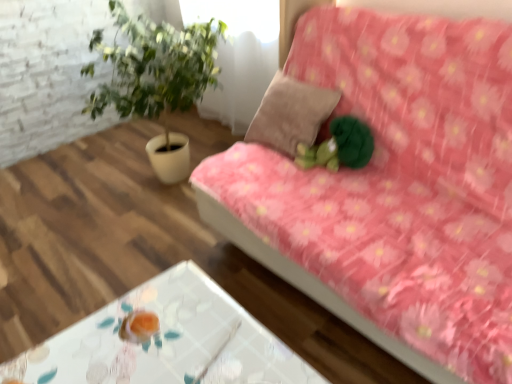
Question: Is green plush toy at center placed right next to suede-like beige pillow at center?

Choices:
 (A) yes
 (B) no

Answer: (B)

Question: Are green plush toy at center and suede-like beige pillow at center located far from each other?

Choices:
 (A) yes
 (B) no

Answer: (B)

Question: Does green plush toy at center lie in front of suede-like beige pillow at center?

Choices:
 (A) yes
 (B) no

Answer: (A)

Question: From the image's perspective, is green plush toy at center below suede-like beige pillow at center?

Choices:
 (A) no
 (B) yes

Answer: (B)

Question: Can you confirm if green plush toy at center is taller than suede-like beige pillow at center?

Choices:
 (A) no
 (B) yes

Answer: (A)

Question: Is pink floral fabric couch at upper right to the left or to the right of transparent glass table at lower center in the image?

Choices:
 (A) left
 (B) right

Answer: (B)

Question: Considering the positions of pink floral fabric couch at upper right and transparent glass table at lower center in the image, is pink floral fabric couch at upper right taller or shorter than transparent glass table at lower center?

Choices:
 (A) tall
 (B) short

Answer: (A)

Question: Looking at their shapes, would you say pink floral fabric couch at upper right is wider or thinner than transparent glass table at lower center?

Choices:
 (A) wide
 (B) thin

Answer: (A)

Question: Is pink floral fabric couch at upper right in front of or behind transparent glass table at lower center in the image?

Choices:
 (A) behind
 (B) front

Answer: (B)

Question: Would you say suede-like beige pillow at center is inside or outside green plush toy at center?

Choices:
 (A) outside
 (B) inside

Answer: (A)

Question: In terms of width, does suede-like beige pillow at center look wider or thinner when compared to green plush toy at center?

Choices:
 (A) thin
 (B) wide

Answer: (B)

Question: Considering their positions, is suede-like beige pillow at center located in front of or behind green plush toy at center?

Choices:
 (A) behind
 (B) front

Answer: (A)

Question: In the image, is suede-like beige pillow at center on the left side or the right side of green plush toy at center?

Choices:
 (A) left
 (B) right

Answer: (A)

Question: Is pink floral fabric couch at upper right wider or thinner than suede-like beige pillow at center?

Choices:
 (A) thin
 (B) wide

Answer: (B)

Question: From a real-world perspective, is pink floral fabric couch at upper right positioned above or below suede-like beige pillow at center?

Choices:
 (A) above
 (B) below

Answer: (B)